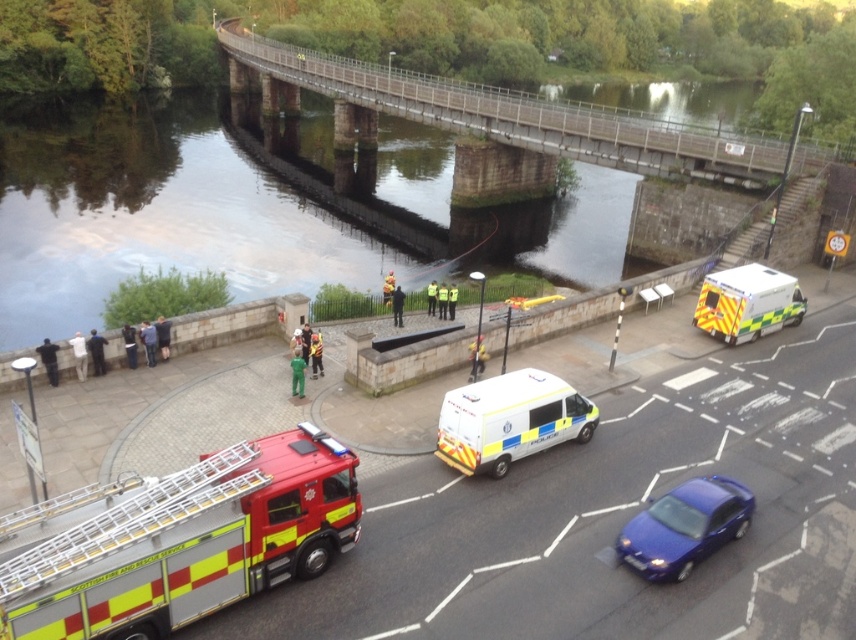
Is point (229, 536) more distant than point (688, 513)?

No, it is not.

Which is above, yellow and red reflective fire truck at lower left or glossy blue sedan at lower right?

Positioned higher is yellow and red reflective fire truck at lower left.

Is point (248, 451) closer to viewer compared to point (714, 492)?

Yes, point (248, 451) is closer to viewer.

The width and height of the screenshot is (856, 640). I want to click on yellow and red reflective fire truck at lower left, so click(x=177, y=540).

This screenshot has height=640, width=856. Describe the element at coordinates (155, 212) in the screenshot. I see `greenish reflective water at center` at that location.

Between greenish reflective water at center and white/police van at center, which one has less height?

white/police van at center is shorter.

This screenshot has height=640, width=856. In order to click on greenish reflective water at center in this screenshot , I will do `click(155, 212)`.

Who is higher up, greenish reflective water at center or yellow reflective van at center-right?

greenish reflective water at center

Is point (403, 164) closer to viewer compared to point (724, 337)?

That is False.

Where is `greenish reflective water at center`? Image resolution: width=856 pixels, height=640 pixels. greenish reflective water at center is located at coordinates (155, 212).